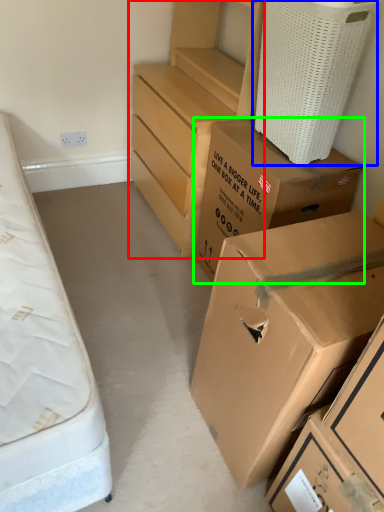
Question: Estimate the real-world distances between objects in this image. Which object is closer to chest of drawers (highlighted by a red box), laundry basket (highlighted by a blue box) or box (highlighted by a green box)?

Choices:
 (A) laundry basket
 (B) box

Answer: (B)